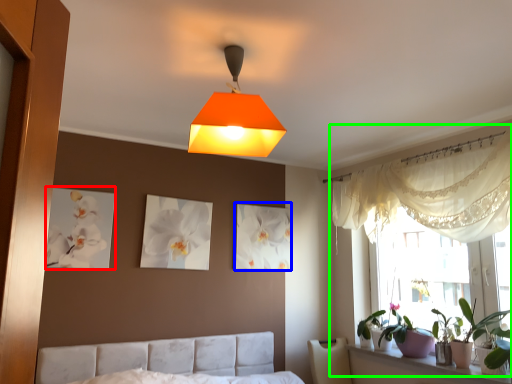
Question: Which is farther away from picture frame (highlighted by a red box)? picture frame (highlighted by a blue box) or bay window (highlighted by a green box)?

Choices:
 (A) picture frame
 (B) bay window

Answer: (B)